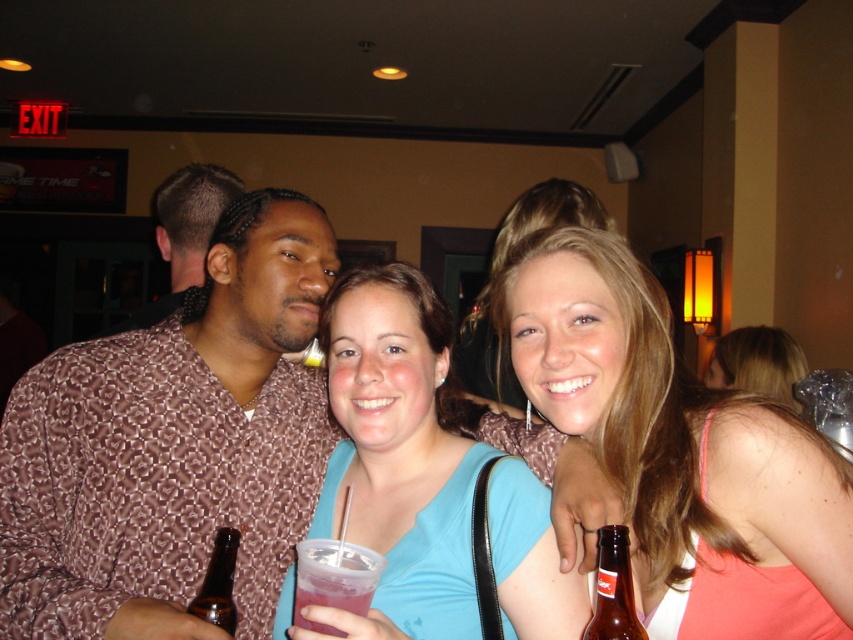
Question: Considering the real-world distances, which object is closest to the blonde hair at upper right?

Choices:
 (A) brown glass bottle at lower right
 (B) blue fabric shirt at center
 (C) brown patterned shirt at center
 (D) brown glass bottle at lower left

Answer: (B)

Question: Does blonde hair at center have a smaller size compared to blonde hair at upper right?

Choices:
 (A) no
 (B) yes

Answer: (A)

Question: Which object appears closest to the camera in this image?

Choices:
 (A) blonde hair at center
 (B) brown glass bottle at lower left
 (C) pink translucent cup at center

Answer: (C)

Question: Is pink translucent cup at center closer to camera compared to brown glass bottle at lower right?

Choices:
 (A) no
 (B) yes

Answer: (A)

Question: Is blonde hair at center to the right of brown glass bottle at lower right from the viewer's perspective?

Choices:
 (A) no
 (B) yes

Answer: (B)

Question: Which point is closer to the camera taking this photo?

Choices:
 (A) (218, 586)
 (B) (175, 188)

Answer: (A)